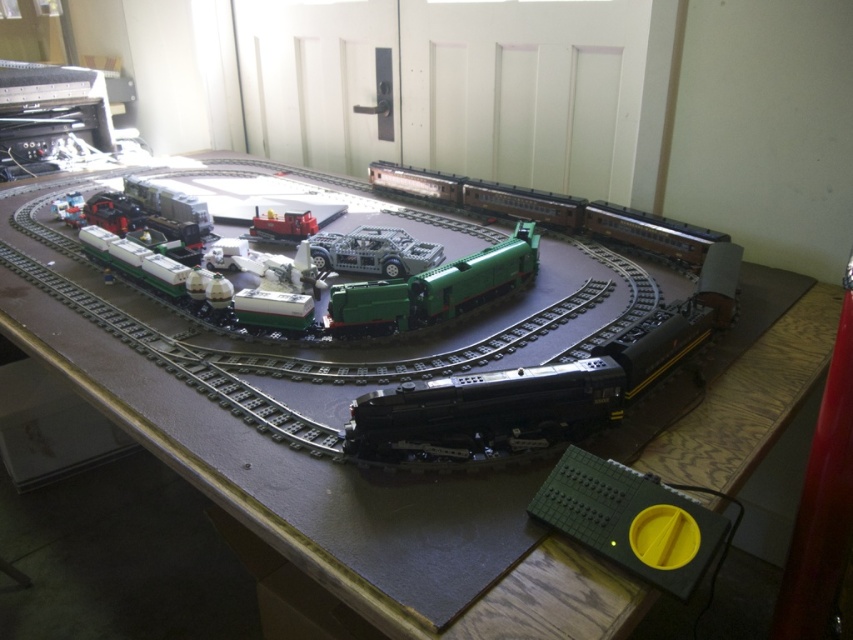
You are a model train enthusiast who wants to place a new train car that is 12 inches long between the shiny black train at center and the green plastic train at center. Is there enough space between them to fit the new train car?

The distance between the shiny black train at center and the green plastic train at center is 14.43 inches. Since the new train car is 12 inches long, there is enough space to fit it between them.

You are a toy collector who wants to display both the green plastic train at center and the translucent gray plastic car at center on a shelf. The shelf has a height limit of 12 inches. Can both items be placed on the shelf without exceeding the height limit?

The green plastic train at center is taller than the translucent gray plastic car at center. However, since the height limit is 12 inches and we don not have specific measurements, it is possible that both items could fit if the tallest item, the green plastic train at center, is under 12 inches. Without exact heights, we cannot confirm for sure.

From the picture: You are a toy designer checking the model train setup. You need to determine if the green plastic train at center can pass through a narrow tunnel designed for the translucent gray plastic car at center. Based on their widths, what is your conclusion?

The green plastic train at center might be wider than the translucent gray plastic car at center, so it may not fit through the tunnel designed for the translucent gray plastic car at center.